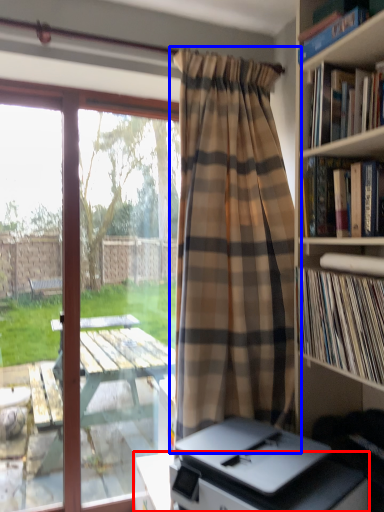
Question: Which of the following is the closest to the observer, table (highlighted by a red box) or curtain (highlighted by a blue box)?

Choices:
 (A) table
 (B) curtain

Answer: (A)